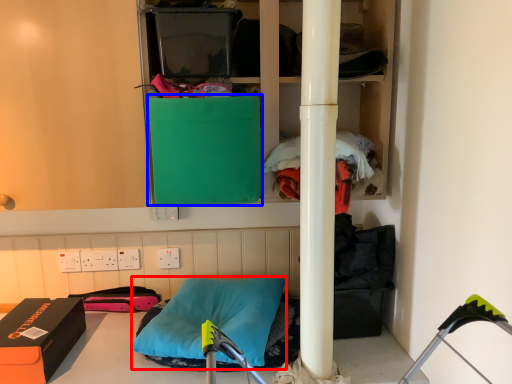
Question: Which object is closer to the camera taking this photo, pillow (highlighted by a red box) or box (highlighted by a blue box)?

Choices:
 (A) pillow
 (B) box

Answer: (B)